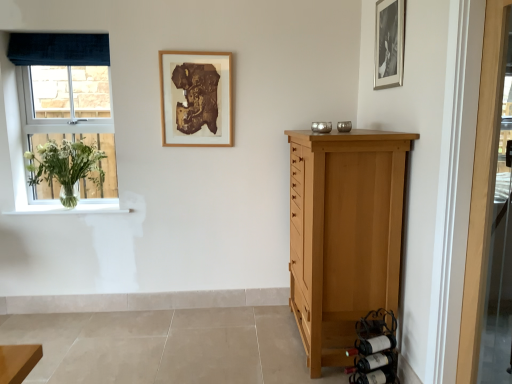
Question: Is the position of dark blue velvet curtain at upper left more distant than that of black matte picture frame at upper right, which appears as the 2th picture frame when viewed from the left?

Choices:
 (A) yes
 (B) no

Answer: (A)

Question: Is dark blue velvet curtain at upper left aimed at black matte picture frame at upper right, which is the 1th picture frame in front-to-back order?

Choices:
 (A) no
 (B) yes

Answer: (A)

Question: Does dark blue velvet curtain at upper left have a greater height compared to black matte picture frame at upper right, which appears as the 2th picture frame when viewed from the left?

Choices:
 (A) no
 (B) yes

Answer: (A)

Question: Can we say dark blue velvet curtain at upper left lies outside black matte picture frame at upper right, which appears as the 2th picture frame when viewed from the left?

Choices:
 (A) no
 (B) yes

Answer: (B)

Question: From the image's perspective, would you say dark blue velvet curtain at upper left is shown under black matte picture frame at upper right, which ranks as the 1th picture frame in right-to-left order?

Choices:
 (A) no
 (B) yes

Answer: (A)

Question: Relative to blue velvet window at left, is dark red glass wine bottle at lower right, which is counted as the 2th wine bottle, starting from the top, in front or behind?

Choices:
 (A) front
 (B) behind

Answer: (A)

Question: Do you think dark red glass wine bottle at lower right, which is counted as the 2th wine bottle, starting from the top, is within blue velvet window at left, or outside of it?

Choices:
 (A) outside
 (B) inside

Answer: (A)

Question: Considering the positions of dark red glass wine bottle at lower right, which appears as the second wine bottle when ordered from the bottom, and blue velvet window at left in the image, is dark red glass wine bottle at lower right, which appears as the second wine bottle when ordered from the bottom, wider or thinner than blue velvet window at left?

Choices:
 (A) thin
 (B) wide

Answer: (B)

Question: From a real-world perspective, is dark red glass wine bottle at lower right, which appears as the second wine bottle when ordered from the bottom, above or below blue velvet window at left?

Choices:
 (A) below
 (B) above

Answer: (A)

Question: Looking at their shapes, would you say black matte picture frame at upper right, acting as the 2th picture frame starting from the back, is wider or thinner than light brown wood chest of drawers at right?

Choices:
 (A) thin
 (B) wide

Answer: (A)

Question: Based on their positions, is black matte picture frame at upper right, which is the 1th picture frame in front-to-back order, located to the left or right of light brown wood chest of drawers at right?

Choices:
 (A) right
 (B) left

Answer: (A)

Question: In the image, is black matte picture frame at upper right, acting as the 2th picture frame starting from the back, positioned in front of or behind light brown wood chest of drawers at right?

Choices:
 (A) behind
 (B) front

Answer: (A)

Question: Considering the positions of point (377, 16) and point (339, 192), is point (377, 16) closer or farther from the camera than point (339, 192)?

Choices:
 (A) closer
 (B) farther

Answer: (B)

Question: Is dark red glass wine bottle at lower right, which appears as the second wine bottle when ordered from the bottom, to the left or to the right of dark brown glass wine bottle at lower right, which appears as the 3th wine bottle when viewed from the top, in the image?

Choices:
 (A) right
 (B) left

Answer: (B)

Question: Considering the positions of dark red glass wine bottle at lower right, which is counted as the 2th wine bottle, starting from the top, and dark brown glass wine bottle at lower right, which appears as the 3th wine bottle when viewed from the top, in the image, is dark red glass wine bottle at lower right, which is counted as the 2th wine bottle, starting from the top, wider or thinner than dark brown glass wine bottle at lower right, which appears as the 3th wine bottle when viewed from the top,?

Choices:
 (A) wide
 (B) thin

Answer: (B)